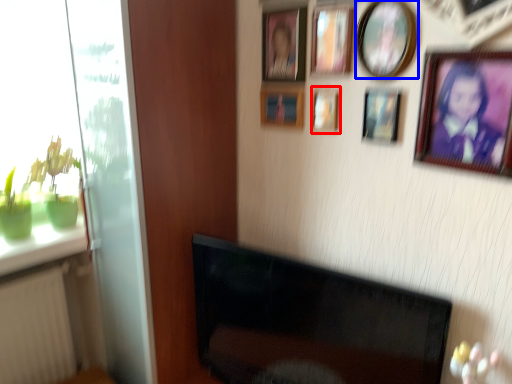
Question: Which object appears closest to the camera in this image, picture frame (highlighted by a red box) or picture frame (highlighted by a blue box)?

Choices:
 (A) picture frame
 (B) picture frame

Answer: (B)